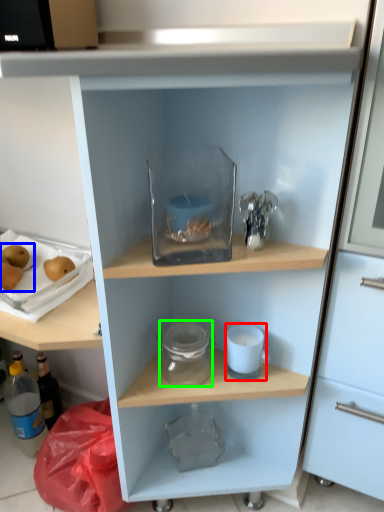
Question: Which object is positioned farthest from appliance (highlighted by a red box)? Select from fruit (highlighted by a blue box) and glass jar (highlighted by a green box).

Choices:
 (A) fruit
 (B) glass jar

Answer: (A)